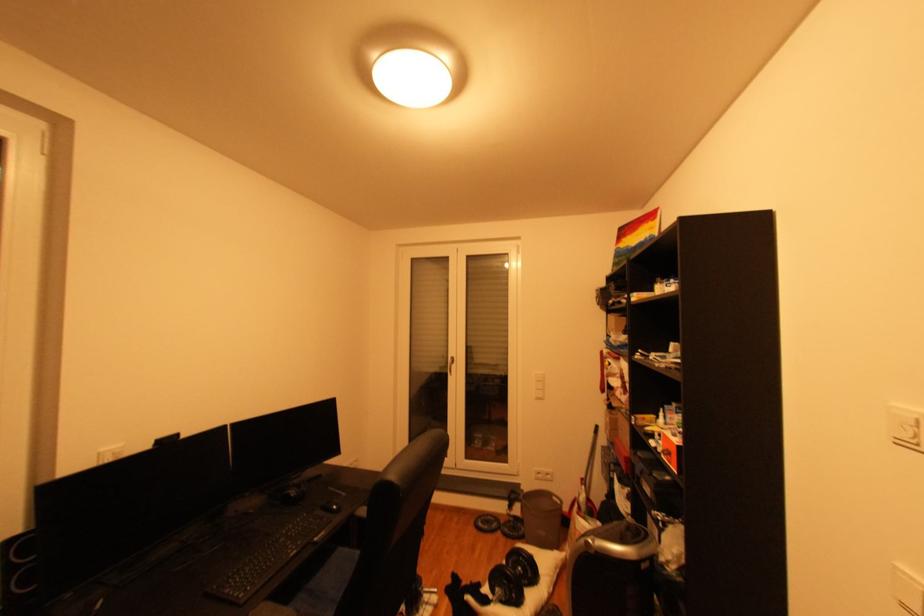
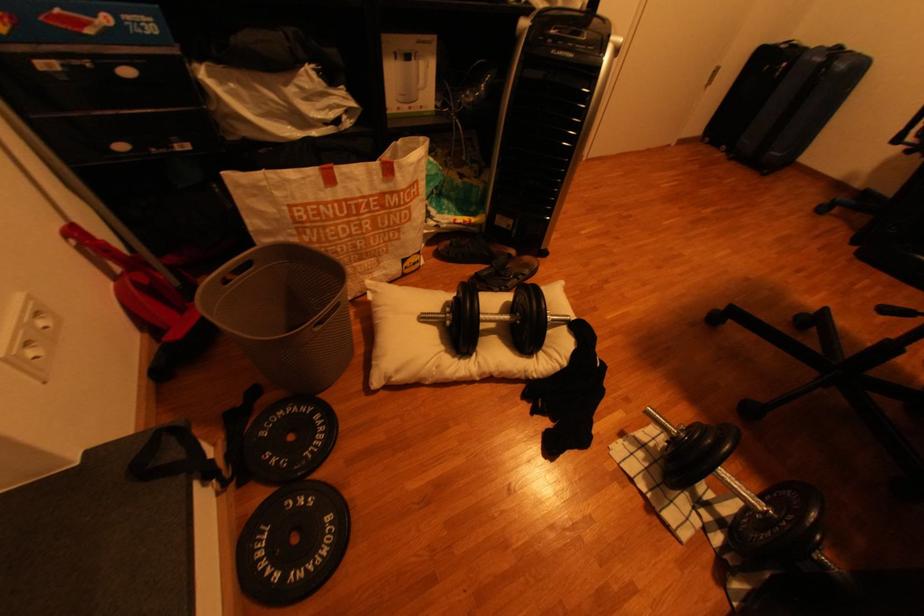
Where in the second image is the point corresponding to (x=502, y=519) from the first image?

(274, 540)